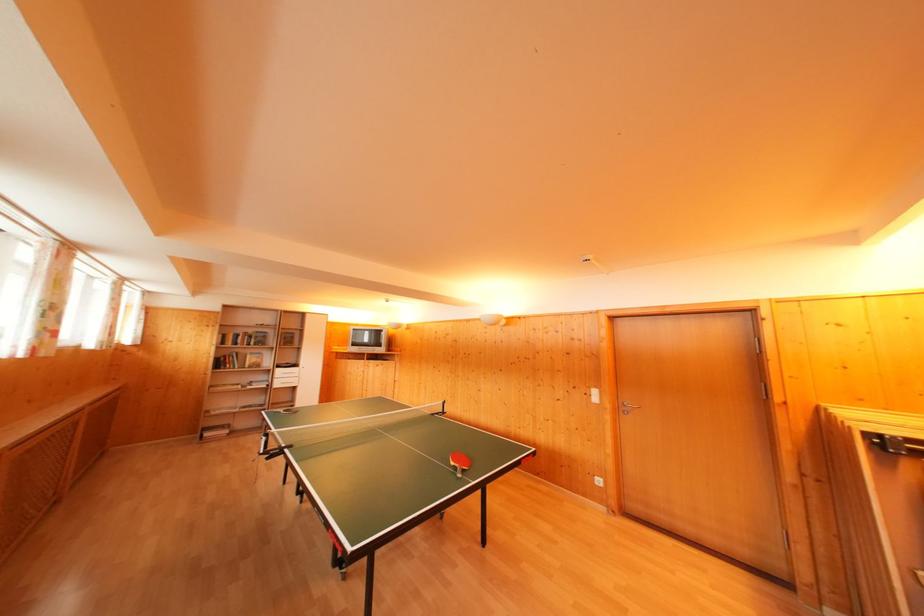
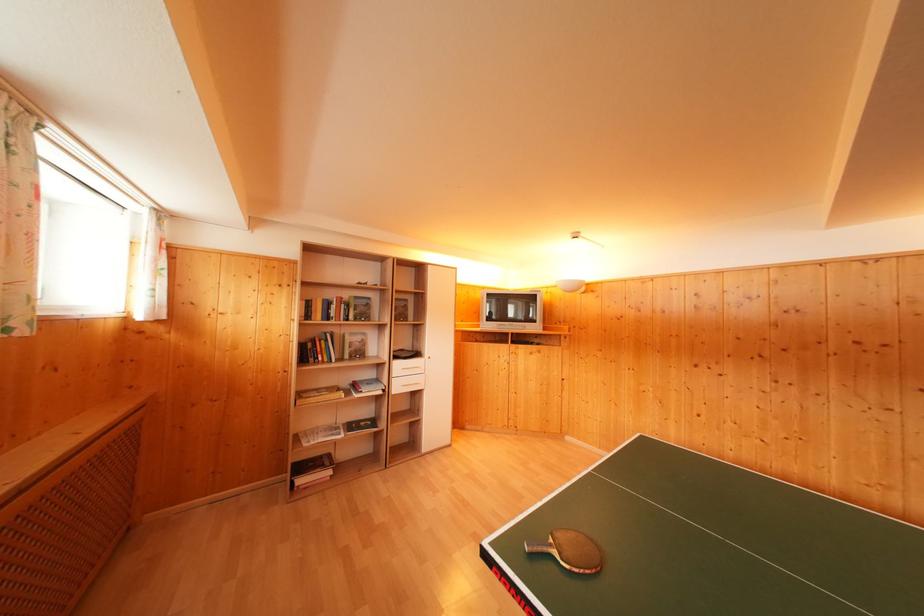
What movement of the cameraman would produce the second image?

The cameraman walked toward left, forward.